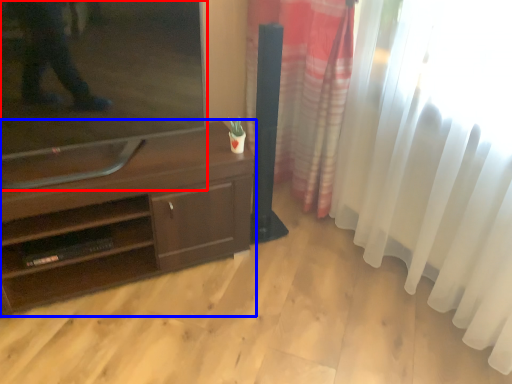
Question: Which object appears farthest to the camera in this image, television (highlighted by a red box) or desk (highlighted by a blue box)?

Choices:
 (A) television
 (B) desk

Answer: (B)